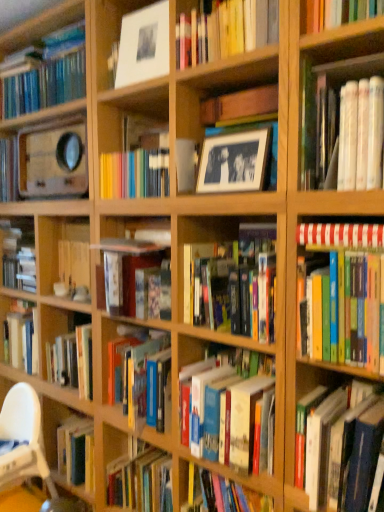
Question: Is white striped book at right, the 5th book positioned from the bottom, outside of hardcover book at center, which appears as the 2th book when ordered from the bottom?

Choices:
 (A) no
 (B) yes

Answer: (B)

Question: Does white striped book at right, the 2th book in the top-to-bottom sequence, have a smaller size compared to hardcover book at center, which appears as the 2th book when ordered from the bottom?

Choices:
 (A) yes
 (B) no

Answer: (A)

Question: Could you tell me if white striped book at right, the 2th book in the top-to-bottom sequence, is facing hardcover book at center, the fifth book positioned from the top?

Choices:
 (A) yes
 (B) no

Answer: (B)

Question: Considering the relative sizes of white striped book at right, the 5th book positioned from the bottom, and hardcover book at center, which appears as the 2th book when ordered from the bottom, in the image provided, is white striped book at right, the 5th book positioned from the bottom, shorter than hardcover book at center, which appears as the 2th book when ordered from the bottom,?

Choices:
 (A) yes
 (B) no

Answer: (A)

Question: From a real-world perspective, is white striped book at right, the 5th book positioned from the bottom, below hardcover book at center, the fifth book positioned from the top?

Choices:
 (A) yes
 (B) no

Answer: (B)

Question: Would you say white striped book at right, the 5th book positioned from the bottom, contains hardcover book at center, the fifth book positioned from the top?

Choices:
 (A) yes
 (B) no

Answer: (B)

Question: Is matte white frame at upper center, the 2th shelf when ordered from right to left, outside hardcover book at center, the fourth book when ordered from bottom to top?

Choices:
 (A) yes
 (B) no

Answer: (A)

Question: Is matte white frame at upper center, arranged as the 1th shelf when viewed from the top, positioned far away from hardcover book at center, the fourth book when ordered from bottom to top?

Choices:
 (A) yes
 (B) no

Answer: (B)

Question: Can you confirm if matte white frame at upper center, the 2th shelf when ordered from right to left, is positioned to the right of hardcover book at center, placed as the third book when sorted from top to bottom?

Choices:
 (A) no
 (B) yes

Answer: (A)

Question: Can you confirm if matte white frame at upper center, arranged as the 1th shelf when viewed from the top, is thinner than hardcover book at center, placed as the third book when sorted from top to bottom?

Choices:
 (A) yes
 (B) no

Answer: (A)

Question: Is matte white frame at upper center, arranged as the 1th shelf when viewed from the top, closer to the viewer compared to hardcover book at center, placed as the third book when sorted from top to bottom?

Choices:
 (A) yes
 (B) no

Answer: (B)

Question: Is matte white frame at upper center, placed as the first shelf when sorted from left to right, smaller than hardcover book at center, the fourth book when ordered from bottom to top?

Choices:
 (A) no
 (B) yes

Answer: (B)

Question: Is white plastic chair at lower left smaller than black matte picture frame at upper center?

Choices:
 (A) no
 (B) yes

Answer: (A)